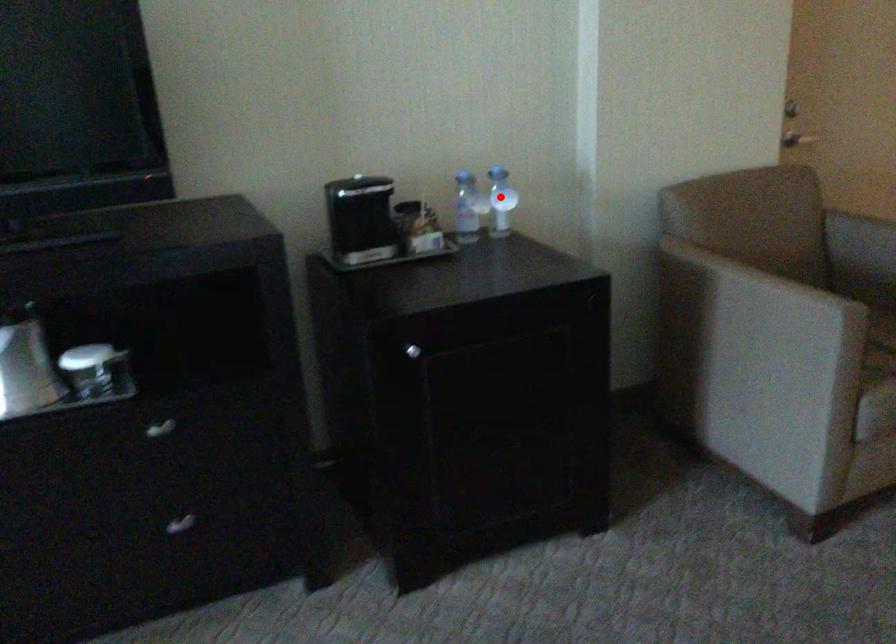
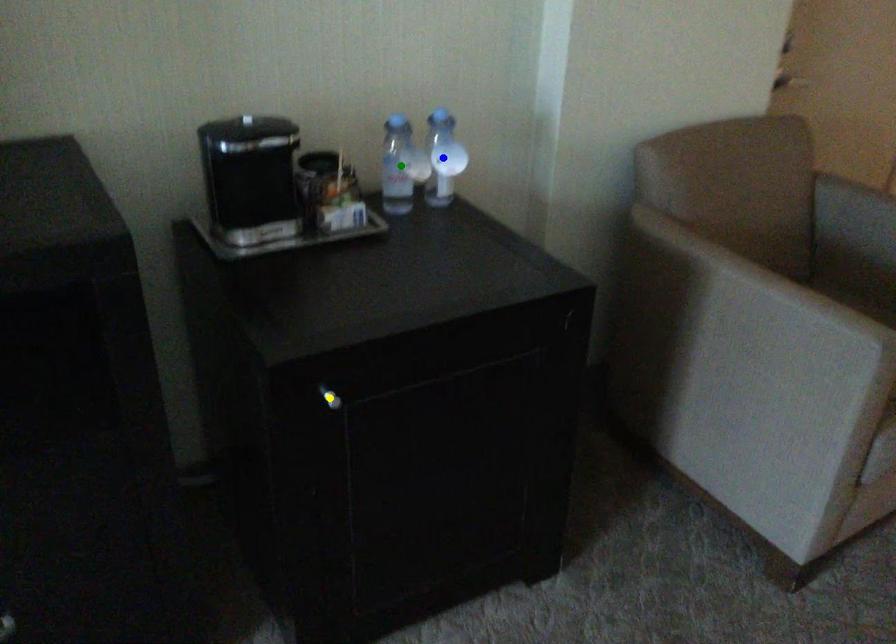
Question: I am providing you with two images of the same scene from different viewpoints. A red point is marked on the first image. You are given multiple points on the second image. Can you choose the point in image 2 that corresponds to the point in image 1?

Choices:
 (A) yellow point
 (B) green point
 (C) blue point

Answer: (C)